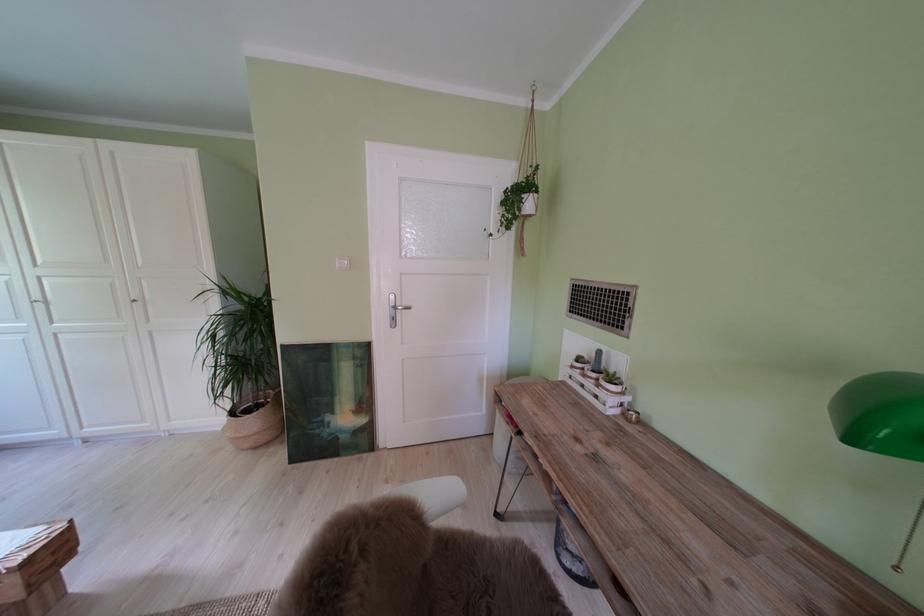
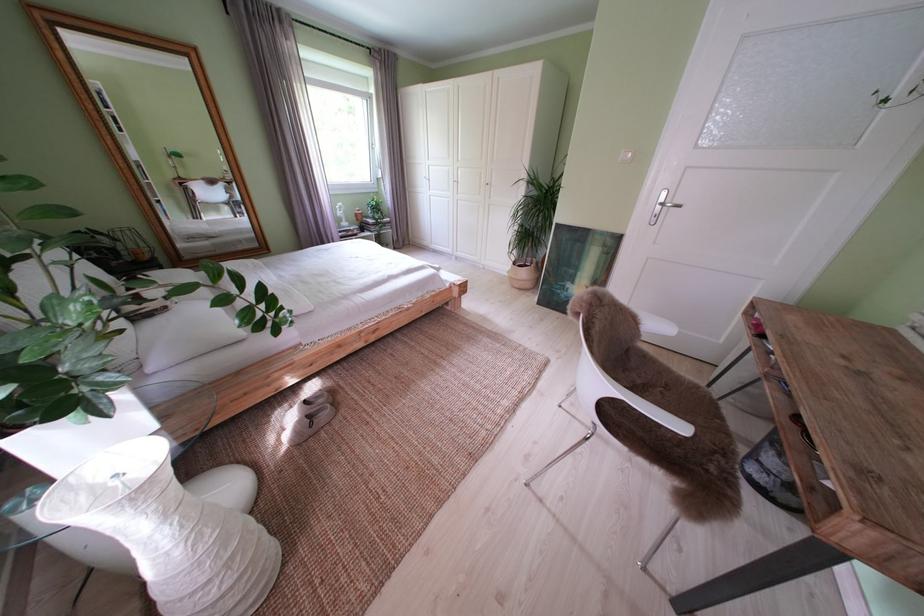
Based on the continuous images, in which direction is the camera rotating?

The rotation direction of the camera is left-down.